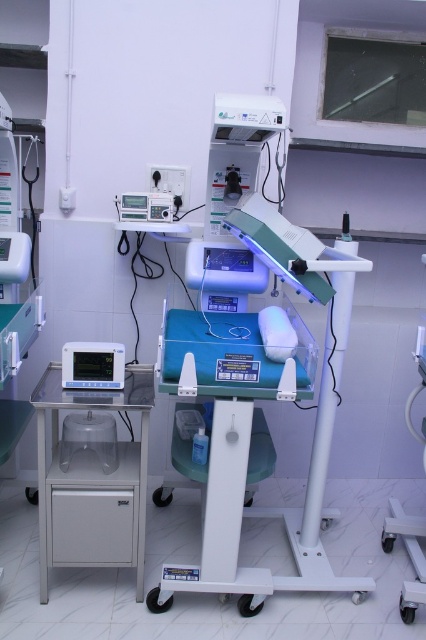
Which is above, blue plastic tray at center or metallic gray monitor at left?

blue plastic tray at center

Where is `blue plastic tray at center`? blue plastic tray at center is located at coordinates (238, 445).

Is metallic gray monitor at left below matte black monitor at left?

Correct, metallic gray monitor at left is located below matte black monitor at left.

Is metallic gray monitor at left positioned at the back of matte black monitor at left?

No, metallic gray monitor at left is in front of matte black monitor at left.

Locate an element on the screen. The height and width of the screenshot is (640, 426). metallic gray monitor at left is located at coordinates (92, 483).

You are a GUI agent. You are given a task and a screenshot of the screen. Output one action in this format:
    pyautogui.click(x=<x>, y=<y>)
    Task: Click on the metallic gray monitor at left
    
    Given the screenshot: What is the action you would take?
    pyautogui.click(x=92, y=483)

Is blue plastic tray at center bigger than matte black monitor at left?

Correct, blue plastic tray at center is larger in size than matte black monitor at left.

Is blue plastic tray at center closer to the viewer compared to matte black monitor at left?

That is True.

Is point (187, 572) farther from viewer compared to point (75, 369)?

Yes, point (187, 572) is farther from viewer.

The height and width of the screenshot is (640, 426). I want to click on blue plastic tray at center, so click(x=238, y=445).